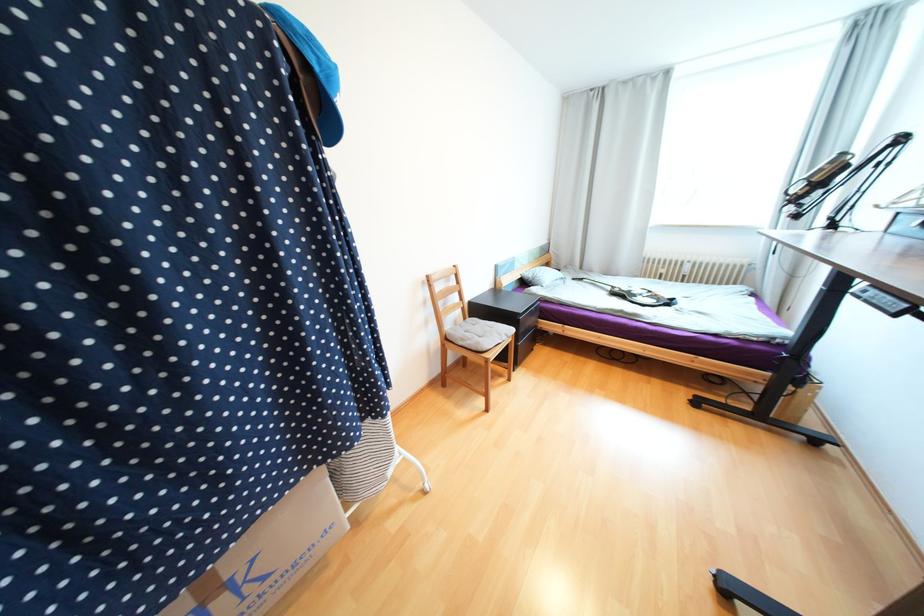
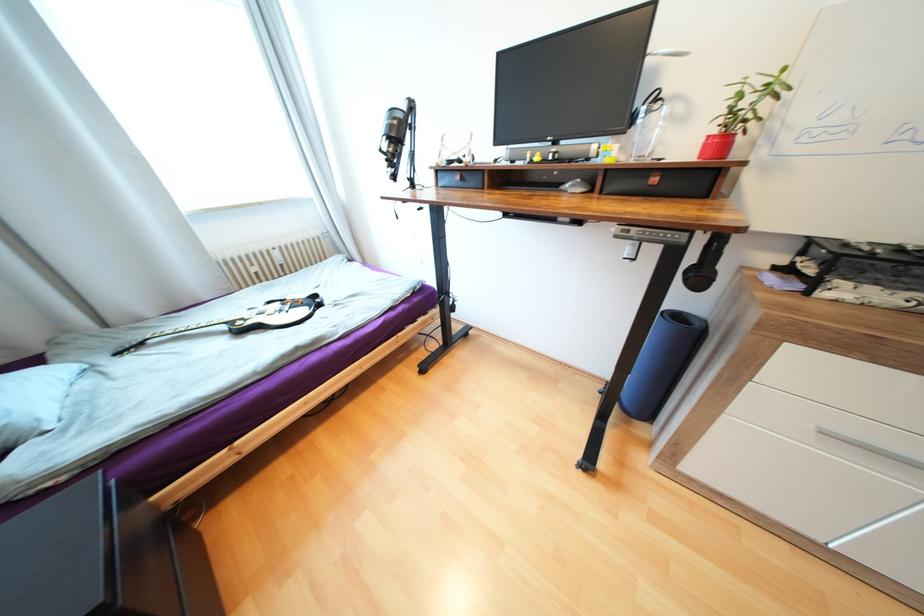
Find the pixel in the second image that matches (614,288) in the first image.

(229, 328)